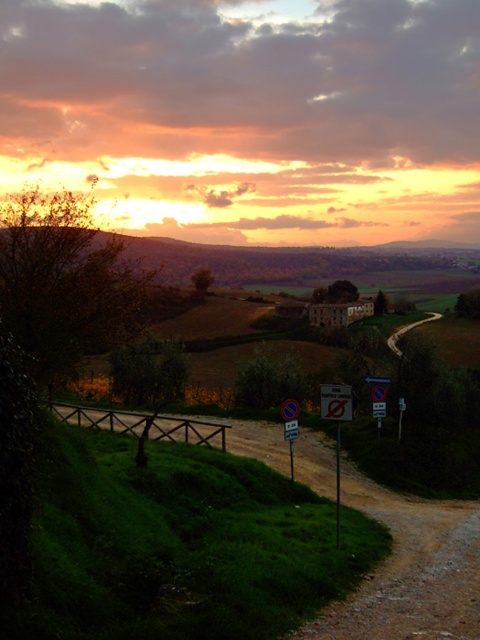
Question: Is dirt/gravel path at lower left to the right of white plastic sign at center from the viewer's perspective?

Choices:
 (A) yes
 (B) no

Answer: (A)

Question: Among these objects, which one is farthest from the camera?

Choices:
 (A) white plastic sign at center
 (B) dirt/gravel path at lower left

Answer: (A)

Question: Which point appears farthest from the camera in this image?

Choices:
 (A) (346, 410)
 (B) (375, 579)

Answer: (A)

Question: Can you confirm if dirt/gravel path at lower left is positioned to the left of white plastic sign at center?

Choices:
 (A) no
 (B) yes

Answer: (A)

Question: Is dirt/gravel path at lower left above white plastic sign at center?

Choices:
 (A) yes
 (B) no

Answer: (B)